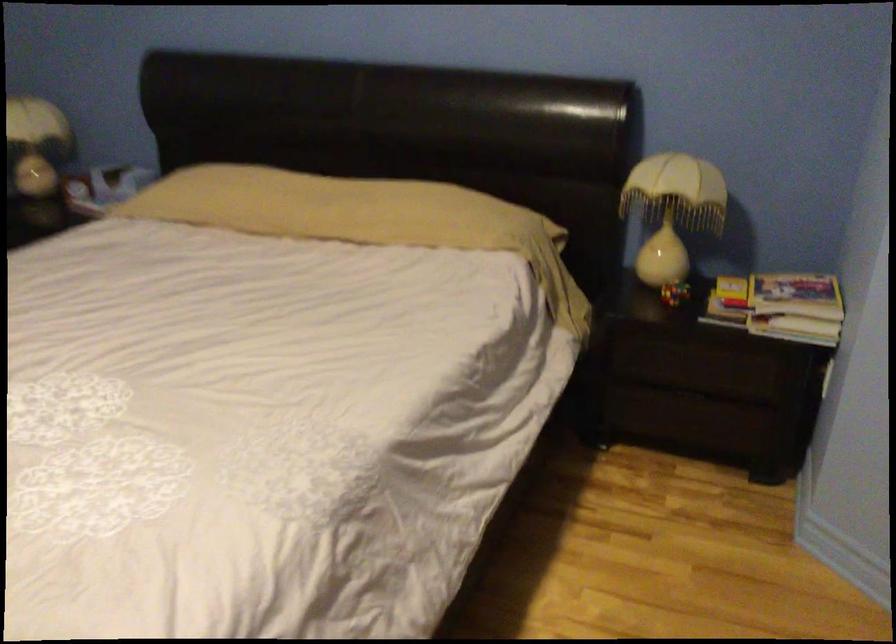
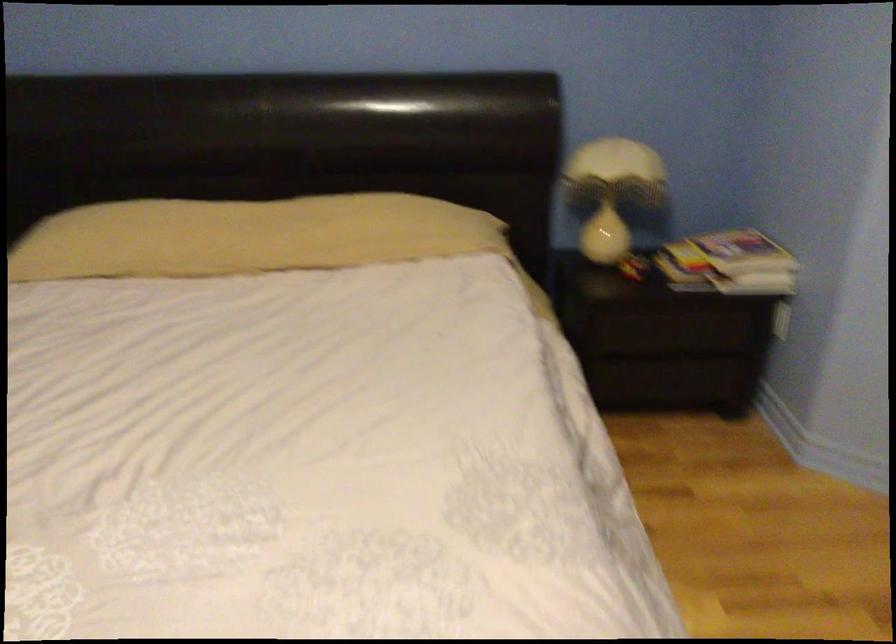
Locate, in the second image, the point that corresponds to pixel 314 205 in the first image.

(247, 236)